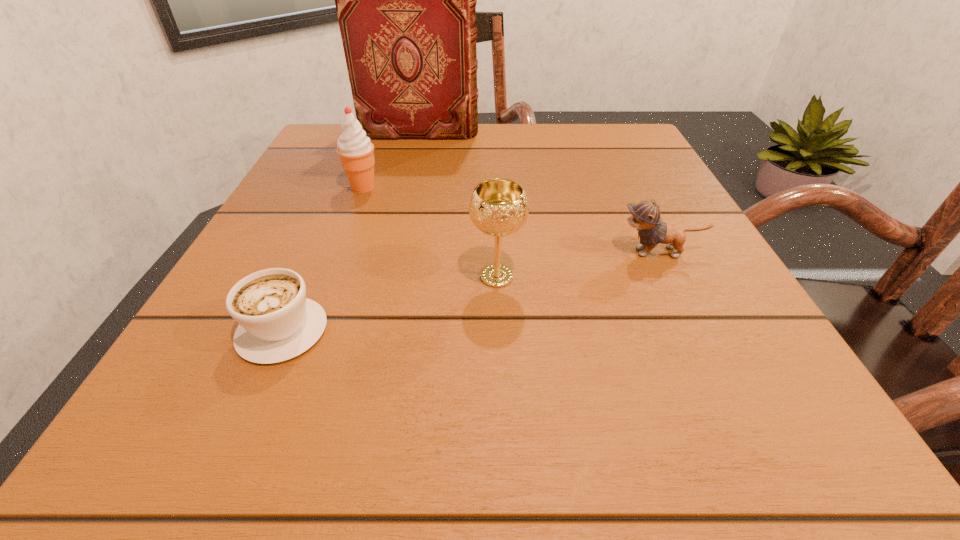
Locate an element on the screen. This screenshot has width=960, height=540. cappuccino located at the left edge is located at coordinates (277, 322).

At what (x,y) coordinates should I click in order to perform the action: click on object positioned at the right edge. Please return your answer as a coordinate pair (x, y). This screenshot has height=540, width=960. Looking at the image, I should click on (645, 216).

You are a GUI agent. You are given a task and a screenshot of the screen. Output one action in this format:
    pyautogui.click(x=<x>, y=<y>)
    Task: Click on the object positioned at the far left corner
    This screenshot has height=540, width=960.
    Given the screenshot: What is the action you would take?
    pyautogui.click(x=406, y=0)

This screenshot has width=960, height=540. In the image, there is a desktop. What are the coordinates of `free region at the far edge` in the screenshot? It's located at (492, 133).

The image size is (960, 540). In order to click on vacant space at the left edge of the desktop in this screenshot , I will do `click(200, 338)`.

This screenshot has width=960, height=540. In order to click on vacant space at the right edge of the desktop in this screenshot , I will do `click(665, 287)`.

In the image, there is a desktop. At what (x,y) coordinates should I click in order to perform the action: click on free space at the far left corner. Please return your answer as a coordinate pair (x, y). Looking at the image, I should click on (335, 125).

The width and height of the screenshot is (960, 540). What are the coordinates of `vacant region at the near left corner of the desktop` in the screenshot? It's located at (232, 431).

Find the location of `vacant space at the far right corner of the desktop`. vacant space at the far right corner of the desktop is located at coordinates (585, 153).

Locate an element on the screen. Image resolution: width=960 pixels, height=540 pixels. free location at the near right corner of the desktop is located at coordinates (826, 458).